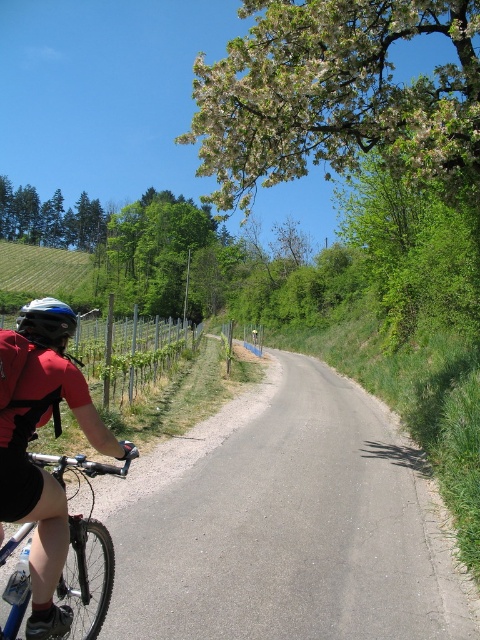
Which of these two, blue matte bicycle at lower left or matte black helmet at left, stands shorter?

Standing shorter between the two is blue matte bicycle at lower left.

Is blue matte bicycle at lower left taller than matte black helmet at left?

In fact, blue matte bicycle at lower left may be shorter than matte black helmet at left.

The image size is (480, 640). What do you see at coordinates (86, 531) in the screenshot?
I see `blue matte bicycle at lower left` at bounding box center [86, 531].

Find the location of `blue matte bicycle at lower left`. blue matte bicycle at lower left is located at coordinates (86, 531).